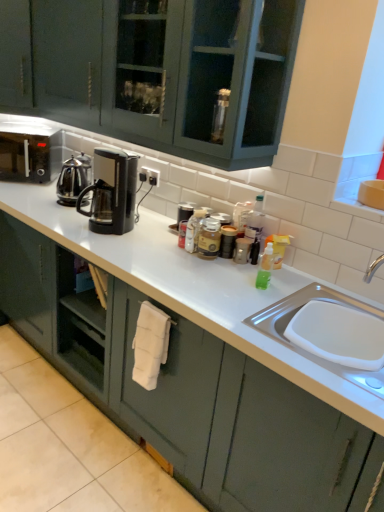
Question: From the image's perspective, does metallic silver canister at center, marked as the second appliance in a back-to-front arrangement, appear higher than black matte microwave at left?

Choices:
 (A) no
 (B) yes

Answer: (A)

Question: Does metallic silver canister at center, marked as the second appliance in a back-to-front arrangement, lie behind black matte microwave at left?

Choices:
 (A) no
 (B) yes

Answer: (A)

Question: Considering the relative positions of metallic silver canister at center, placed as the first appliance when sorted from front to back, and black matte microwave at left in the image provided, is metallic silver canister at center, placed as the first appliance when sorted from front to back, to the right of black matte microwave at left from the viewer's perspective?

Choices:
 (A) yes
 (B) no

Answer: (A)

Question: Considering the relative positions of metallic silver canister at center, which appears as the 2th appliance when viewed from the left, and black matte microwave at left in the image provided, is metallic silver canister at center, which appears as the 2th appliance when viewed from the left, to the left of black matte microwave at left from the viewer's perspective?

Choices:
 (A) no
 (B) yes

Answer: (A)

Question: From a real-world perspective, is metallic silver canister at center, placed as the first appliance when sorted from front to back, physically above black matte microwave at left?

Choices:
 (A) yes
 (B) no

Answer: (B)

Question: Considering the positions of point (82, 185) and point (173, 373), is point (82, 185) closer or farther from the camera than point (173, 373)?

Choices:
 (A) closer
 (B) farther

Answer: (B)

Question: Looking at their shapes, would you say polished stainless steel kettle at left, the first kitchen appliance viewed from the left, is wider or thinner than matte green cabinet at center?

Choices:
 (A) thin
 (B) wide

Answer: (A)

Question: Visually, is polished stainless steel kettle at left, the first kitchen appliance viewed from the back, positioned to the left or to the right of matte green cabinet at center?

Choices:
 (A) left
 (B) right

Answer: (A)

Question: From the image's perspective, relative to matte green cabinet at center, is polished stainless steel kettle at left, the 2th kitchen appliance viewed from the front, above or below?

Choices:
 (A) below
 (B) above

Answer: (B)

Question: From the image's perspective, is black plastic coffee maker at center, the first kitchen appliance viewed from the right, positioned above or below matte green cabinet at center?

Choices:
 (A) below
 (B) above

Answer: (B)

Question: In terms of width, does black plastic coffee maker at center, which ranks as the 2th kitchen appliance in left-to-right order, look wider or thinner when compared to matte green cabinet at center?

Choices:
 (A) wide
 (B) thin

Answer: (B)

Question: Is black plastic coffee maker at center, which ranks as the 2th kitchen appliance in left-to-right order, inside the boundaries of matte green cabinet at center, or outside?

Choices:
 (A) outside
 (B) inside

Answer: (A)

Question: From a real-world perspective, relative to matte green cabinet at center, is black plastic coffee maker at center, which is the 2th kitchen appliance from back to front, vertically above or below?

Choices:
 (A) above
 (B) below

Answer: (A)

Question: Choose the correct answer: Is black plastic coffee maker at center, which ranks as the first kitchen appliance in front-to-back order, inside polished stainless steel kettle at left, the 2th kitchen appliance viewed from the front, or outside it?

Choices:
 (A) inside
 (B) outside

Answer: (B)

Question: Considering the positions of black plastic coffee maker at center, which ranks as the 2th kitchen appliance in left-to-right order, and polished stainless steel kettle at left, the 2th kitchen appliance viewed from the front, in the image, is black plastic coffee maker at center, which ranks as the 2th kitchen appliance in left-to-right order, taller or shorter than polished stainless steel kettle at left, the 2th kitchen appliance viewed from the front,?

Choices:
 (A) tall
 (B) short

Answer: (A)